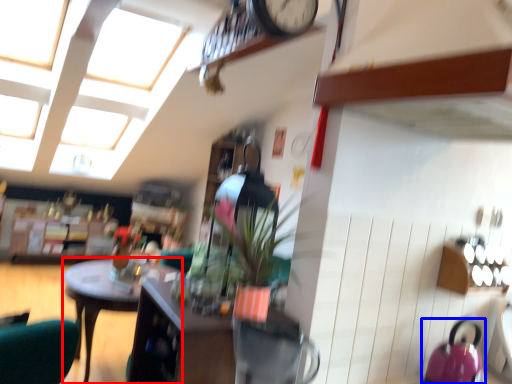
Question: Which point is closer to the camera, desk (highlighted by a red box) or kettle (highlighted by a blue box)?

Choices:
 (A) desk
 (B) kettle

Answer: (B)